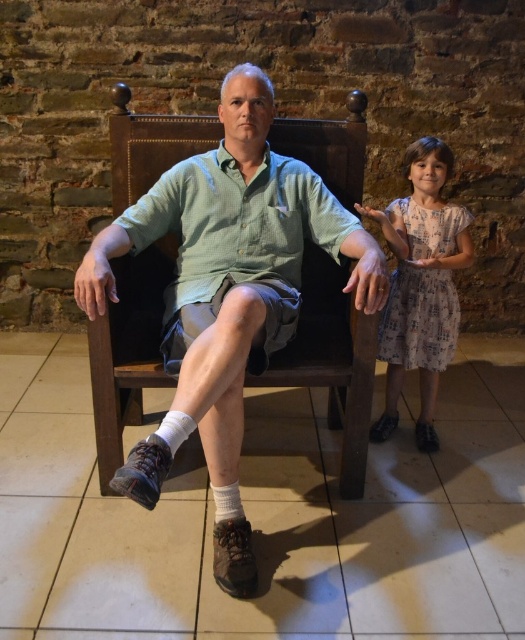
You are a photographer setting up a shoot in the scene. You need to ensure that the green checkered shirt at center and the dusty pink dress at right are visible in the frame. Based on their positions, which direction should you position your camera relative to the subjects to capture both?

Since the green checkered shirt at center is positioned on the left side of dusty pink dress at right, you should position your camera to the left of the subjects to ensure both the green checkered shirt at center and the dusty pink dress at right are visible in the frame.

You are a photographer setting up for a group photo. You need to ensure there is enough space between the green checkered shirt at center and the dusty pink dress at right for a proper composition. The minimum required distance is 24 inches. Is the current distance sufficient?

The green checkered shirt at center and dusty pink dress at right are 20.42 inches apart from each other, which is less than the required 24 inches. Therefore, the current distance is insufficient for the proper composition.

Looking at this image, you are a photographer planning to take a portrait of the two subjects in the scene. The adult wearing the green checkered shirt at center is seated, and the young girl in the dusty pink dress at right is standing. To ensure both are fully visible in the frame, should you position the camera closer to the seated subject or the standing one?

You should position the camera closer to the seated adult wearing the green checkered shirt at center because it is in front of the dusty pink dress at right, ensuring both subjects remain visible in the frame.